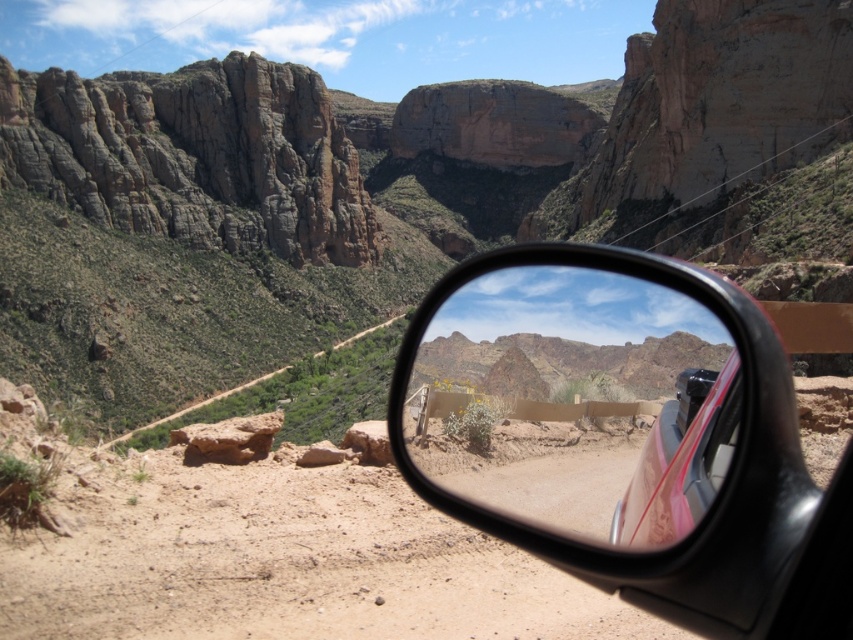
Question: Which is farther from the metallic car side mirror at center?

Choices:
 (A) clear glass window at center
 (B) dirt/path at center
 (C) brown sandy dirt track at lower center
 (D) pink glossy car at right

Answer: (B)

Question: Is metallic car side mirror at center in front of clear glass window at center?

Choices:
 (A) no
 (B) yes

Answer: (B)

Question: Is brown sandy dirt track at lower center to the right of pink glossy car at right from the viewer's perspective?

Choices:
 (A) no
 (B) yes

Answer: (A)

Question: Does pink glossy car at right appear under dirt/path at center?

Choices:
 (A) yes
 (B) no

Answer: (A)

Question: Among these points, which one is farthest from the camera?

Choices:
 (A) (347, 554)
 (B) (727, 440)
 (C) (619, 544)

Answer: (A)

Question: Based on their relative distances, which object is farther from the metallic car side mirror at center?

Choices:
 (A) clear glass window at center
 (B) dirt/path at center
 (C) brown sandy dirt track at lower center
 (D) pink glossy car at right

Answer: (B)